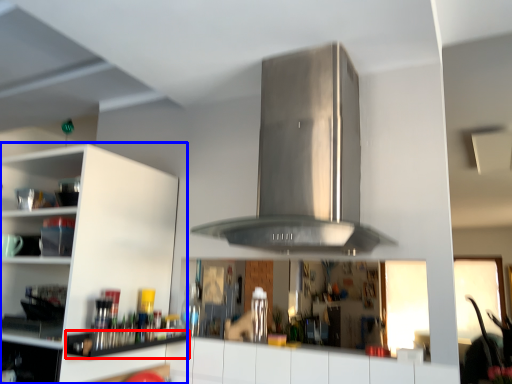
Question: Which object is further to the camera taking this photo, shelf (highlighted by a red box) or cabinetry (highlighted by a blue box)?

Choices:
 (A) shelf
 (B) cabinetry

Answer: (A)